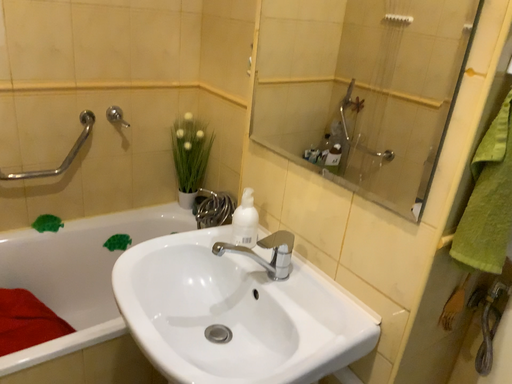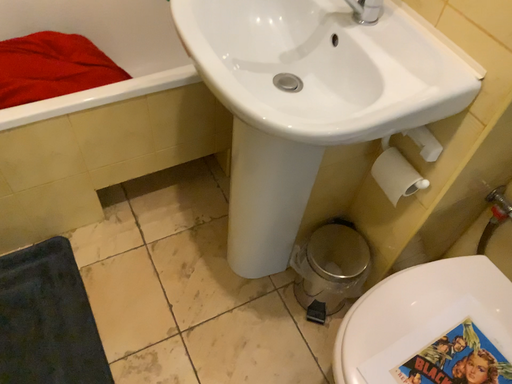
Question: Which way did the camera rotate in the video?

Choices:
 (A) rotated right
 (B) rotated left

Answer: (B)